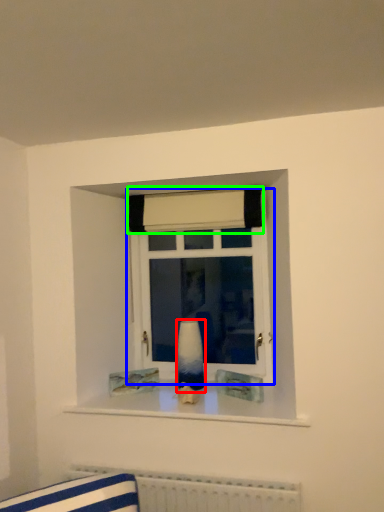
Question: Which object is the farthest from vase (highlighted by a red box)? Choose among these: window (highlighted by a blue box) or curtain (highlighted by a green box).

Choices:
 (A) window
 (B) curtain

Answer: (B)